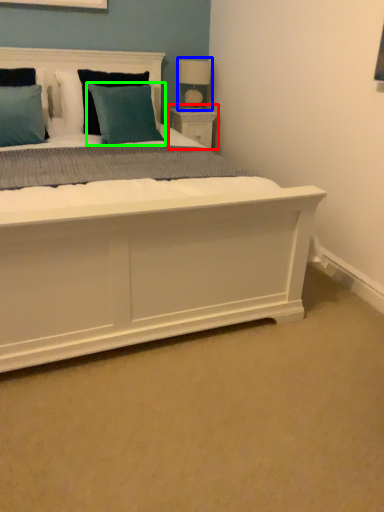
Question: Which object is the closest to the nightstand (highlighted by a red box)? Choose among these: table lamp (highlighted by a blue box) or pillow (highlighted by a green box).

Choices:
 (A) table lamp
 (B) pillow

Answer: (A)